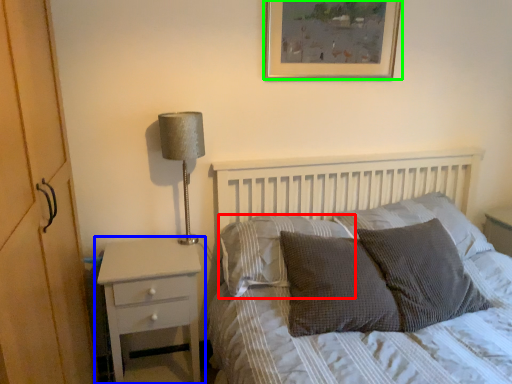
Question: Based on their relative distances, which object is nearer to pillow (highlighted by a red box)? Choose from nightstand (highlighted by a blue box) and picture frame (highlighted by a green box).

Choices:
 (A) nightstand
 (B) picture frame

Answer: (A)